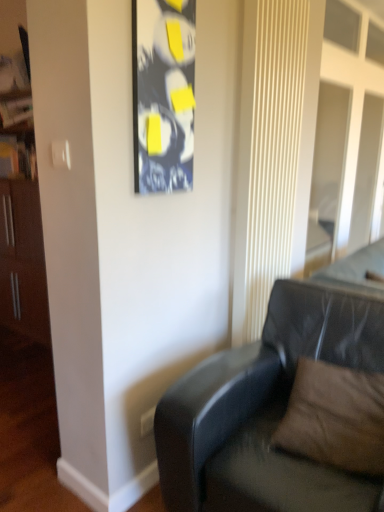
Question: From the image's perspective, relative to black glossy picture frame at upper center, is brown suede pillow at lower right above or below?

Choices:
 (A) below
 (B) above

Answer: (A)

Question: From a real-world perspective, is brown suede pillow at lower right above or below black glossy picture frame at upper center?

Choices:
 (A) below
 (B) above

Answer: (A)

Question: Estimate the real-world distances between objects in this image. Which object is farther from the brown suede pillow at lower right?

Choices:
 (A) black leather couch at lower right
 (B) black glossy picture frame at upper center

Answer: (B)

Question: Which object is the farthest from the black glossy picture frame at upper center?

Choices:
 (A) black leather couch at lower right
 (B) brown suede pillow at lower right

Answer: (B)